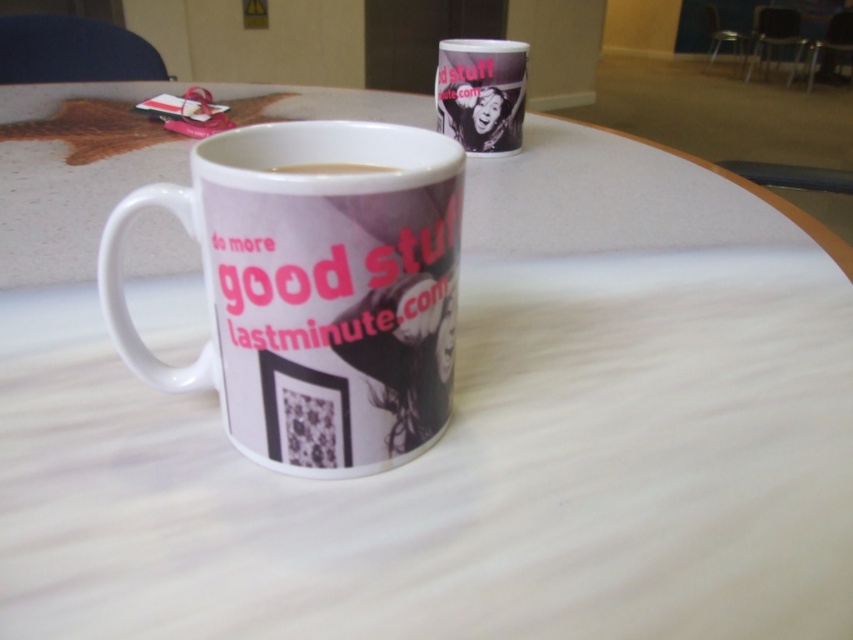
You are at a coffee shop and see two mugs on the table. You want to grab the one that is on the right side. Which one should you choose between the white ceramic mug at center and the white glossy coffee cup at center?

The white glossy coffee cup at center is on the right side, so you should choose the white glossy coffee cup at center.

You are at a coffee shop and want to place your order. The barista asks you to point out which cup you want. You see the white paper cup at upper center and the white glossy coffee cup at center. Which one is higher up?

The white paper cup at upper center is higher up because it is located above the white glossy coffee cup at center.

You are at a coffee shop counter and see the white ceramic mug at center and the white paper cup at upper center. Which one is closer to you?

The white ceramic mug at center is closer to you because it is in front of the white paper cup at upper center.